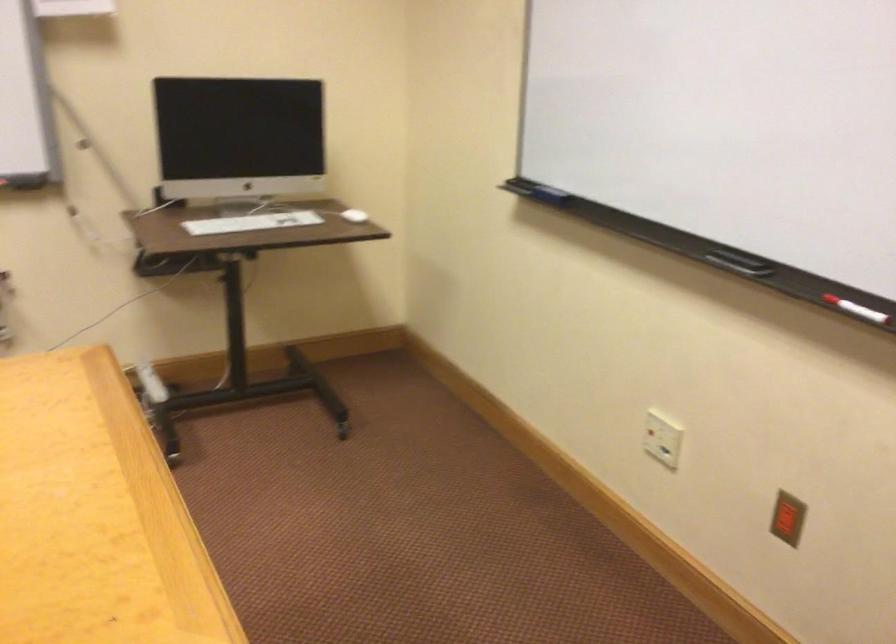
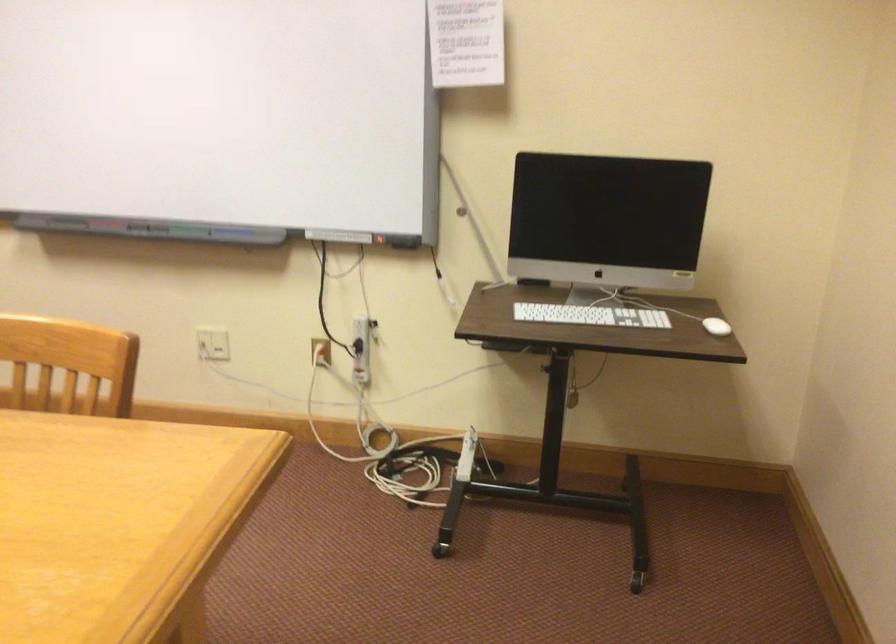
Question: Based on the continuous images, in which direction is the camera rotating? Reply with the corresponding letter.

Choices:
 (A) Left
 (B) Right
 (C) Up
 (D) Down

Answer: (A)